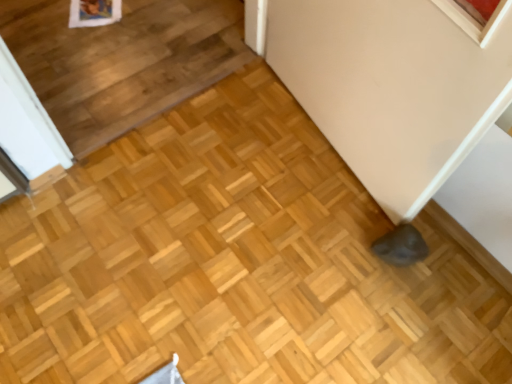
Identify the location of free point below white matte door at lower right (from a real-world perspective). The height and width of the screenshot is (384, 512). (332, 147).